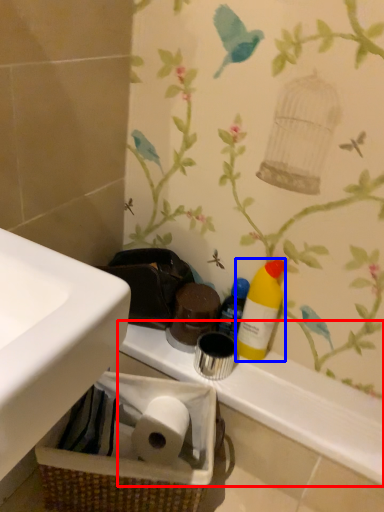
Question: Which of the following is the closest to the observer, counter top (highlighted by a red box) or cleaning product (highlighted by a blue box)?

Choices:
 (A) counter top
 (B) cleaning product

Answer: (A)